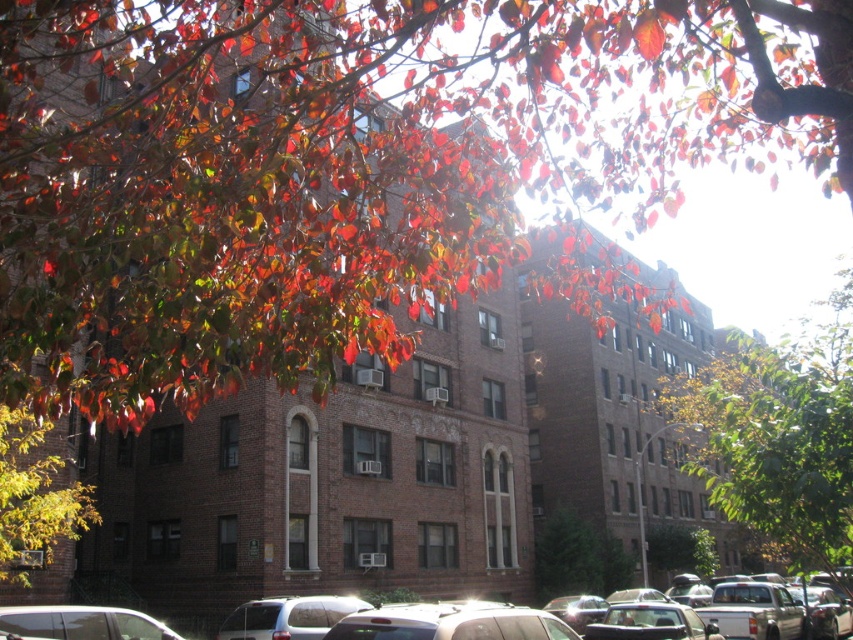
Consider the image. Can you confirm if shiny red leaves at upper center is wider than shiny green leaves at lower left?

Correct, the width of shiny red leaves at upper center exceeds that of shiny green leaves at lower left.

Between point (317, 276) and point (51, 492), which one is positioned in front?

Point (317, 276) is more forward.

Identify the location of shiny red leaves at upper center. This screenshot has width=853, height=640. (347, 164).

In the scene shown: Which is more to the left, shiny red leaves at upper center or metallic silver car at lower left?

metallic silver car at lower left

Is point (657, 96) positioned after point (120, 621)?

That is True.

Identify the location of shiny red leaves at upper center. (347, 164).

Between matte silver sedan at center and matte silver suv at lower center, which one appears on the right side from the viewer's perspective?

matte silver sedan at center is more to the right.

Between matte silver sedan at center and matte silver suv at lower center, which one is positioned lower?

Positioned lower is matte silver sedan at center.

Measure the distance between point (822,632) and camera.

73.66 feet

Where is `matte silver sedan at center`? matte silver sedan at center is located at coordinates (822, 612).